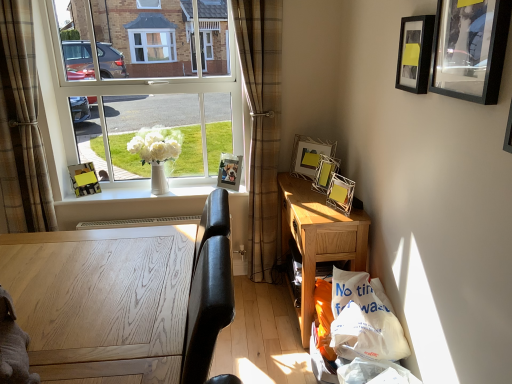
This screenshot has width=512, height=384. I want to click on free space above clear glass window at upper left (from a real-world perspective), so click(144, 0).